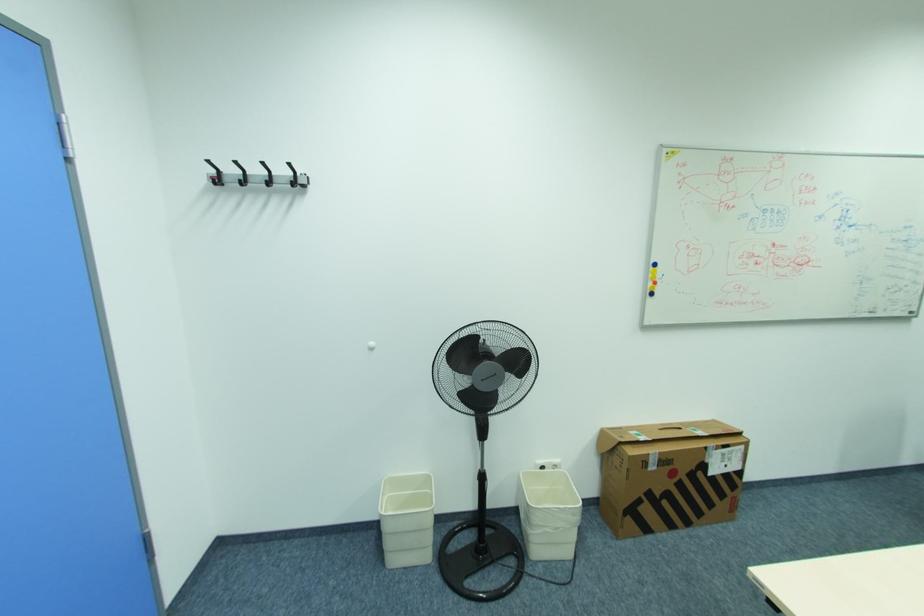
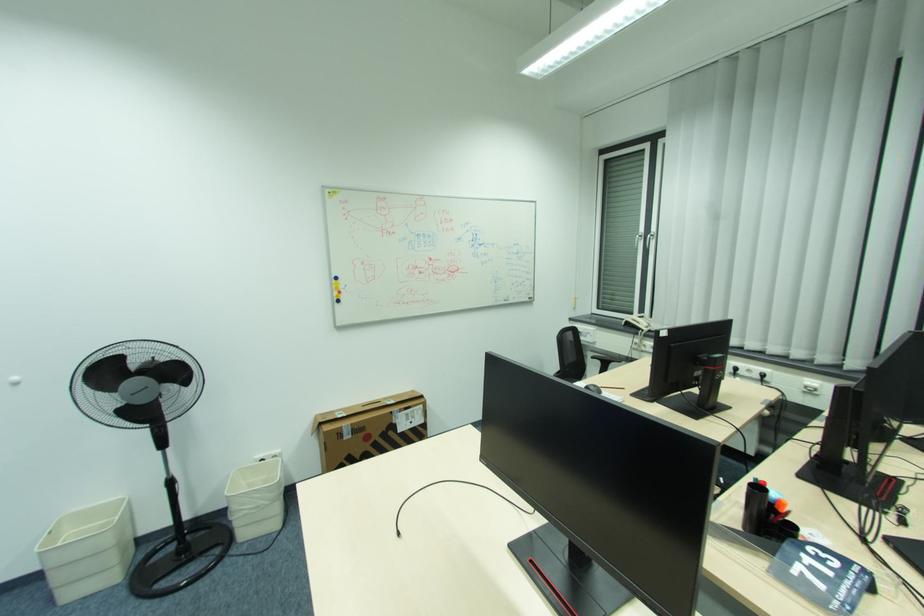
In the second image, find the point that corresponds to (x=657, y=269) in the first image.

(339, 282)